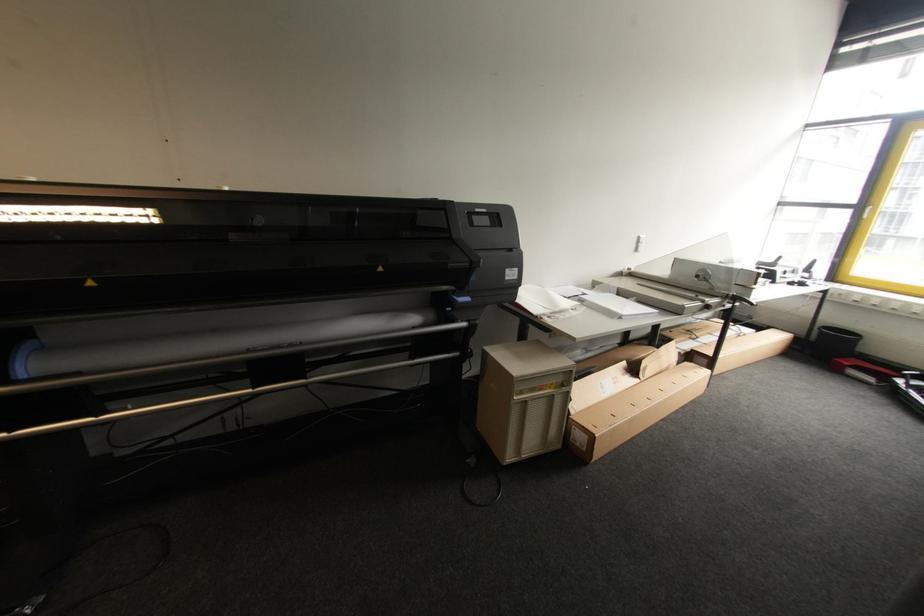
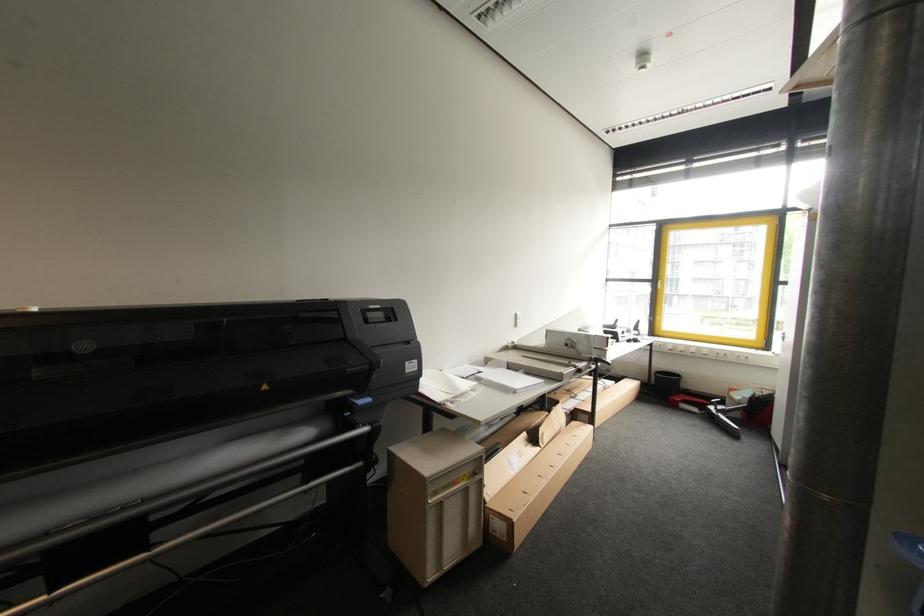
In the second image, find the point that corresponds to (x=455, y=238) in the first image.

(348, 339)